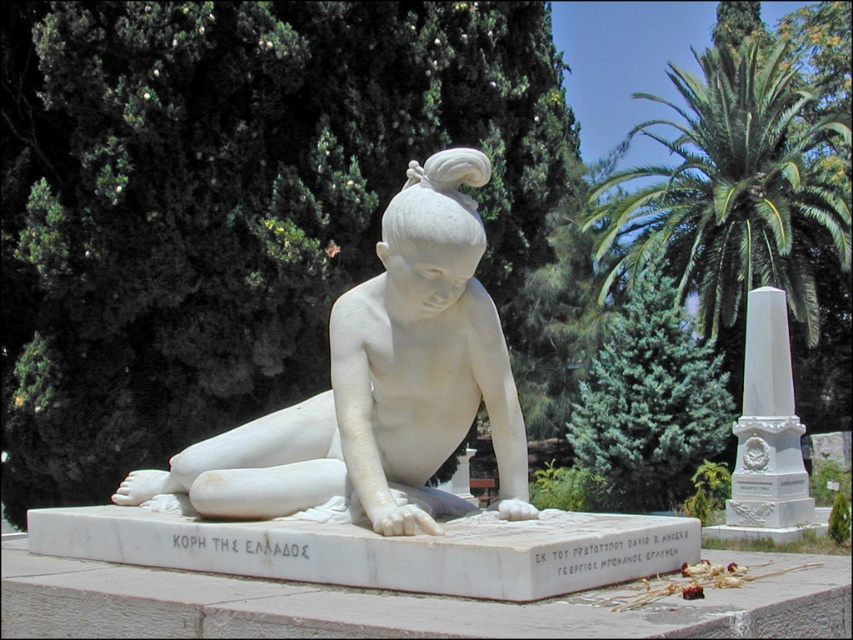
Is white marble statue at center bigger than green leafy palm at upper right?

No.

Identify the location of white marble statue at center. The image size is (853, 640). (378, 387).

This screenshot has width=853, height=640. I want to click on white marble statue at center, so click(378, 387).

Find the location of a particular element. The image size is (853, 640). green leafy palm at upper right is located at coordinates (746, 209).

Which is behind, point (811, 269) or point (763, 355)?

Positioned behind is point (811, 269).

Between point (793, 168) and point (770, 355), which one is positioned in front?

Point (770, 355) is in front.

Where is `green leafy palm at upper right`? green leafy palm at upper right is located at coordinates (746, 209).

Is white marble statue at center smaller than white marble obelisk at right?

Yes, white marble statue at center is smaller than white marble obelisk at right.

Image resolution: width=853 pixels, height=640 pixels. Describe the element at coordinates (378, 387) in the screenshot. I see `white marble statue at center` at that location.

The height and width of the screenshot is (640, 853). What are the coordinates of `white marble statue at center` in the screenshot? It's located at (378, 387).